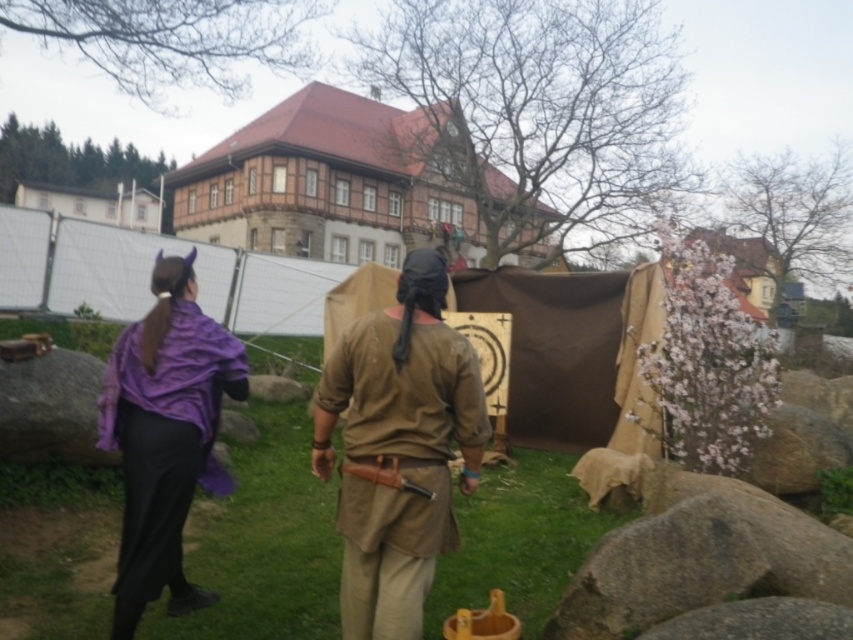
Question: Which of the following is the closest to the observer?

Choices:
 (A) brown leather apron at center
 (B) purple matte robe at left

Answer: (A)

Question: Observing the image, what is the correct spatial positioning of brown leather apron at center in reference to purple matte robe at left?

Choices:
 (A) above
 (B) below

Answer: (A)

Question: Among these objects, which one is farthest from the camera?

Choices:
 (A) brown leather apron at center
 (B) purple matte robe at left

Answer: (B)

Question: Can you confirm if brown leather apron at center is bigger than purple matte robe at left?

Choices:
 (A) no
 (B) yes

Answer: (A)

Question: In this image, where is brown leather apron at center located relative to purple matte robe at left?

Choices:
 (A) above
 (B) below

Answer: (A)